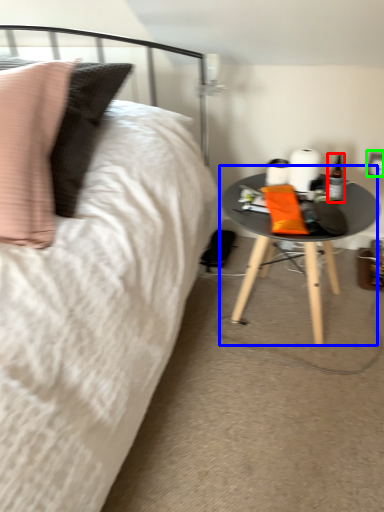
Question: Which object is positioned closest to bottle (highlighted by a red box)? Select from table (highlighted by a blue box) and electric outlet (highlighted by a green box).

Choices:
 (A) table
 (B) electric outlet

Answer: (B)